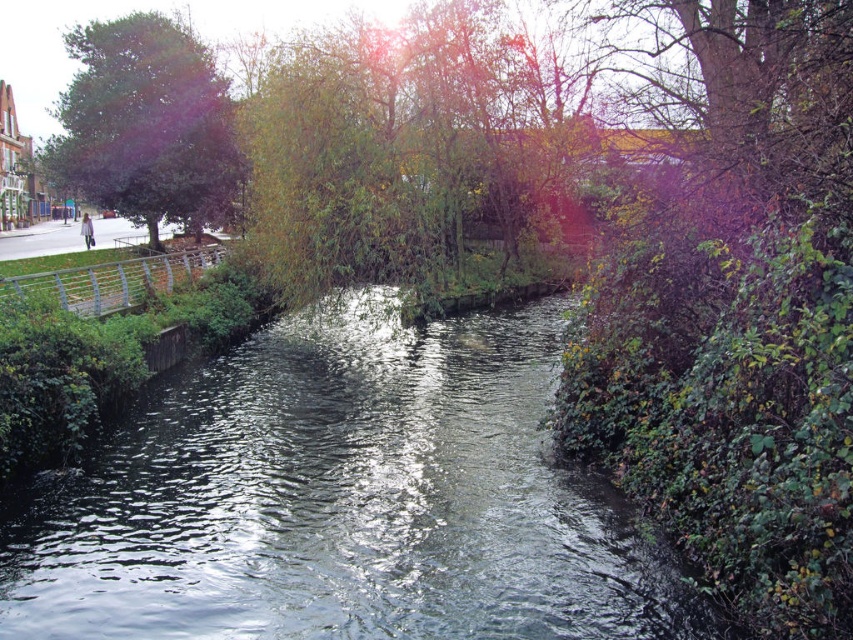
Looking at this image, you are standing at the edge of the waterway and want to know which object is taller between the clear water at center and the green leafy tree at left. Can you tell me?

The clear water at center has a lesser height compared to the green leafy tree at left, so the green leafy tree at left is taller.

You are standing on the grassy embankment next to the metal railing on the left side of the waterway. You want to take a photo of the clear water at center and the green leafy tree at left. In which direction should you point your camera to capture both subjects in the frame?

To capture both the clear water at center and the green leafy tree at left in the frame, you should point your camera to the right of the green leafy tree at left since the clear water at center is located to the right of it.